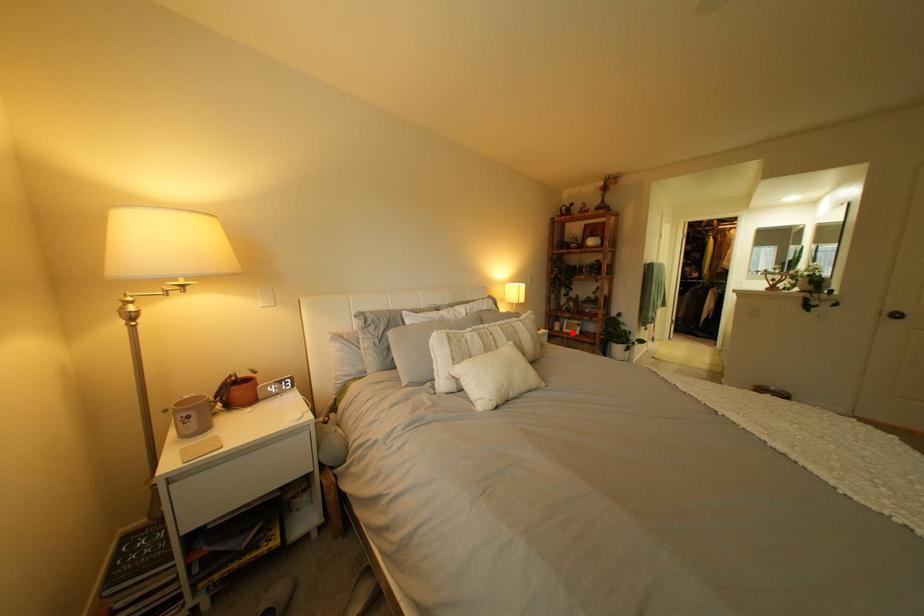
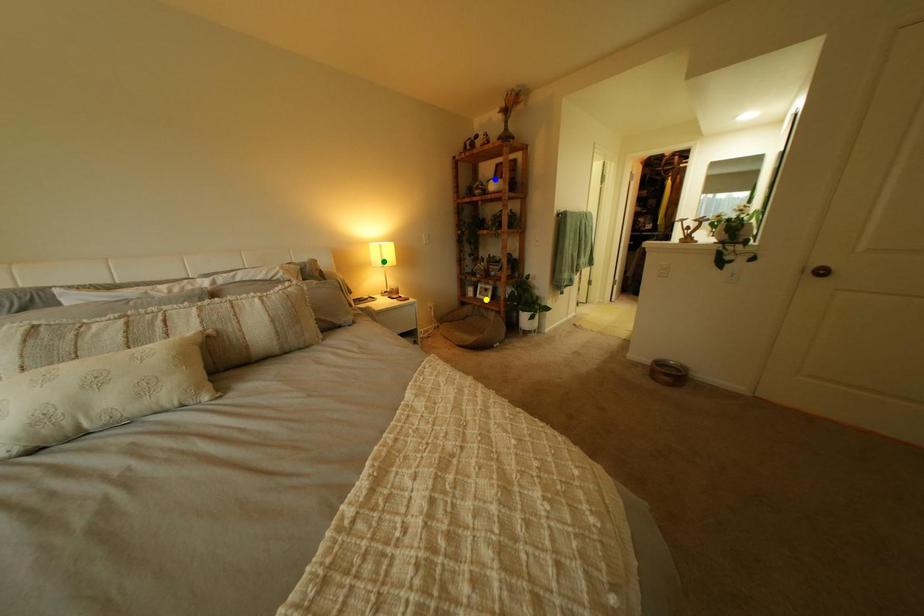
Question: I am providing you with two images of the same scene from different viewpoints. A red point is marked on the first image. You are given multiple points on the second image. In image 2, which mark is for the same physical point as the one in image 1?

Choices:
 (A) green point
 (B) yellow point
 (C) blue point

Answer: (B)